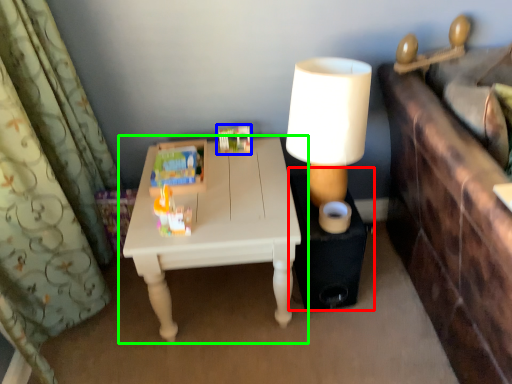
Question: Which object is positioned closest to side table (highlighted by a red box)? Select from toy (highlighted by a blue box) and table (highlighted by a green box).

Choices:
 (A) toy
 (B) table

Answer: (B)